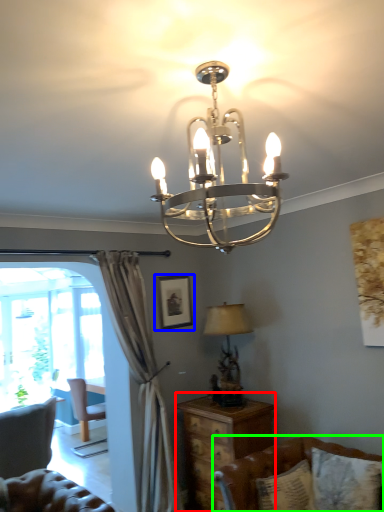
Question: Which is farther away from nightstand (highlighted by a red box)? picture frame (highlighted by a blue box) or studio couch (highlighted by a green box)?

Choices:
 (A) picture frame
 (B) studio couch

Answer: (A)